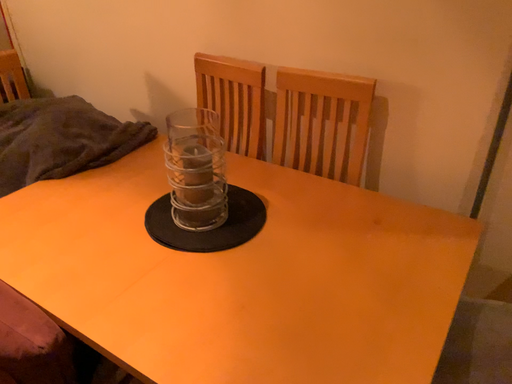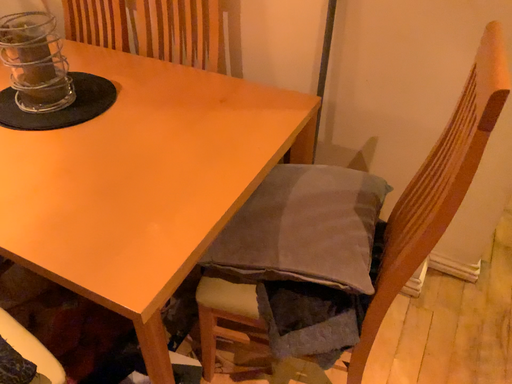
Question: Which way did the camera rotate in the video?

Choices:
 (A) rotated right
 (B) rotated left

Answer: (A)